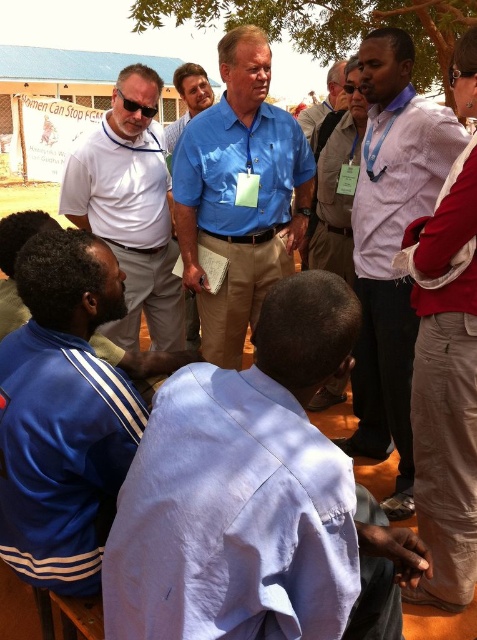
Between blue fabric shirt at lower center and blue cotton shirt at center, which one appears on the right side from the viewer's perspective?

blue fabric shirt at lower center is more to the right.

Does blue fabric shirt at lower center appear on the right side of blue cotton shirt at center?

Indeed, blue fabric shirt at lower center is positioned on the right side of blue cotton shirt at center.

Is point (308, 330) positioned after point (278, 177)?

No, (308, 330) is closer to viewer.

Locate an element on the screen. blue fabric shirt at lower center is located at coordinates (255, 499).

Does blue fabric jacket at lower left appear over white shirt at center?

No.

Which is behind, point (10, 340) or point (311, 234)?

Positioned behind is point (311, 234).

You are a GUI agent. You are given a task and a screenshot of the screen. Output one action in this format:
    pyautogui.click(x=<x>, y=<y>)
    Task: Click on the blue fabric jacket at lower left
    This screenshot has height=640, width=477.
    Given the screenshot: What is the action you would take?
    pyautogui.click(x=62, y=413)

From the picture: Who is more forward, [371,636] or [121,212]?

Point [371,636]

Which of these two, blue fabric shirt at lower center or white matte shirt at center, stands shorter?

blue fabric shirt at lower center is shorter.

Between point (415, 540) and point (145, 269), which one is positioned in front?

Point (415, 540) is more forward.

Identify the location of blue fabric shirt at lower center. Image resolution: width=477 pixels, height=640 pixels. (255, 499).